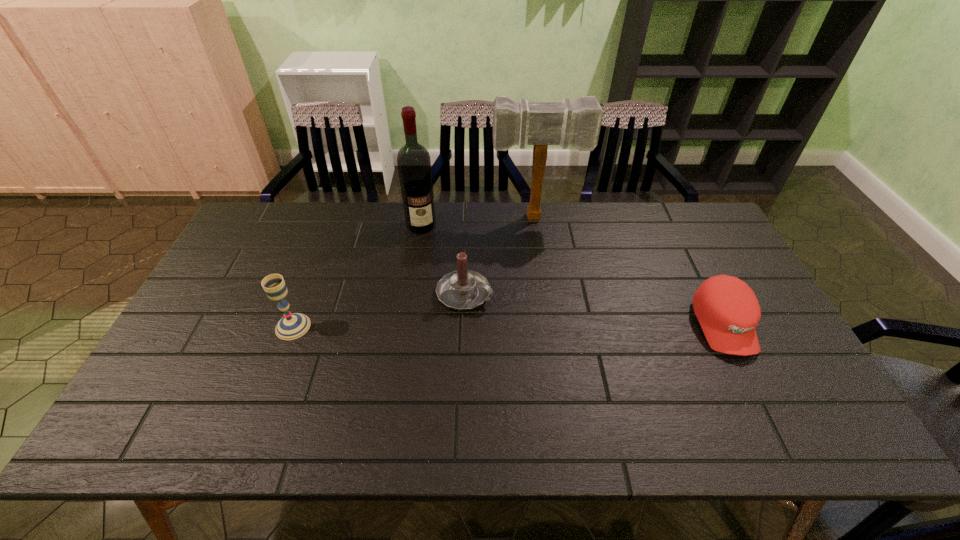
At what (x,y) coordinates should I click in order to perform the action: click on chalice. Please return your answer as a coordinate pair (x, y). The width and height of the screenshot is (960, 540). Looking at the image, I should click on (293, 325).

I want to click on the rightmost object, so click(727, 309).

Where is `cap`? The image size is (960, 540). cap is located at coordinates (727, 309).

At what (x,y) coordinates should I click in order to perform the action: click on candle. Please return your answer as a coordinate pair (x, y). The width and height of the screenshot is (960, 540). Looking at the image, I should click on (463, 289).

Image resolution: width=960 pixels, height=540 pixels. Find the location of `mallet`. mallet is located at coordinates [578, 123].

Locate an element on the screen. The image size is (960, 540). alcohol is located at coordinates (414, 165).

In order to click on vacant space located on the right of the chalice in this screenshot , I will do `click(336, 327)`.

Where is `vacant space located on the front-facing side of the shortest object`? vacant space located on the front-facing side of the shortest object is located at coordinates (761, 401).

This screenshot has width=960, height=540. What are the coordinates of `blank space located 0.170m on the side of the candle with the handle loop` in the screenshot? It's located at (542, 330).

The width and height of the screenshot is (960, 540). Identify the location of blank space located 0.330m on the side of the candle with the handle loop. (598, 356).